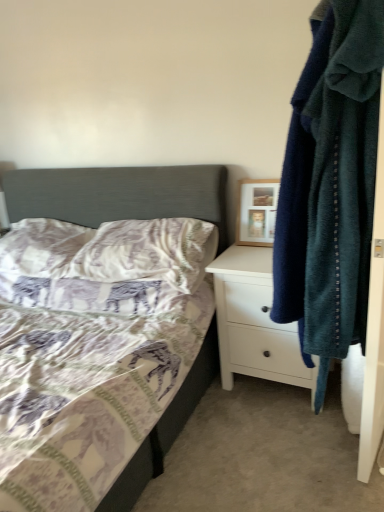
Question: Would you say white matte chest of drawers at right is to the left or to the right of wooden picture frame at upper right in the picture?

Choices:
 (A) right
 (B) left

Answer: (A)

Question: Looking at the image, does white matte chest of drawers at right seem bigger or smaller compared to wooden picture frame at upper right?

Choices:
 (A) small
 (B) big

Answer: (B)

Question: Estimate the real-world distances between objects in this image. Which object is closer to the patterned fabric pillow at center, which appears as the 2th pillow when viewed from the left?

Choices:
 (A) patterned fabric bed at center
 (B) white textured pillow at lower left, which ranks as the 2th pillow in right-to-left order
 (C) soft blue towel at right
 (D) wooden picture frame at upper right
 (E) white matte chest of drawers at right

Answer: (A)

Question: Which is nearer to the white matte chest of drawers at right?

Choices:
 (A) patterned fabric bed at center
 (B) patterned fabric pillow at center, acting as the 1th pillow starting from the right
 (C) wooden picture frame at upper right
 (D) white textured pillow at lower left, which ranks as the 2th pillow in right-to-left order
 (E) soft blue towel at right

Answer: (C)